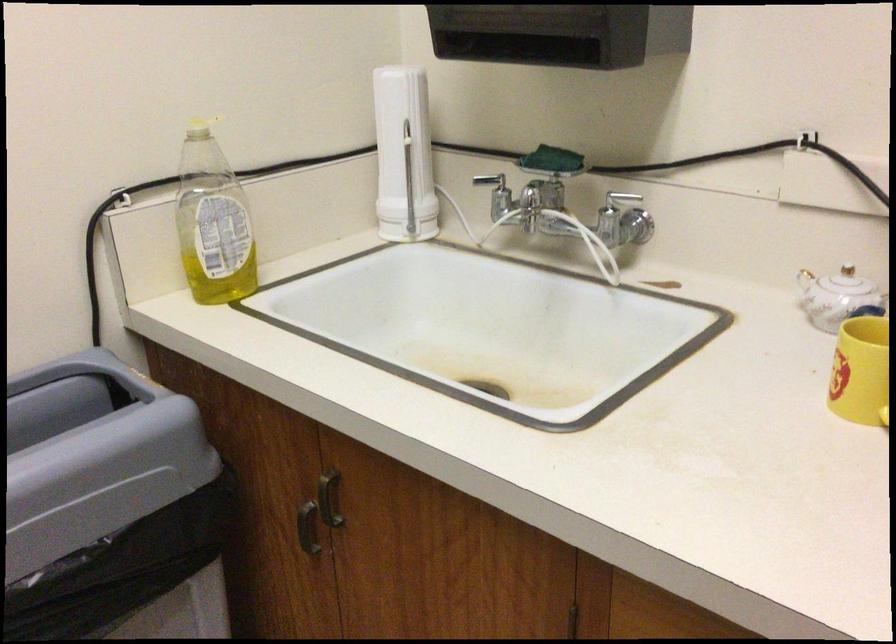
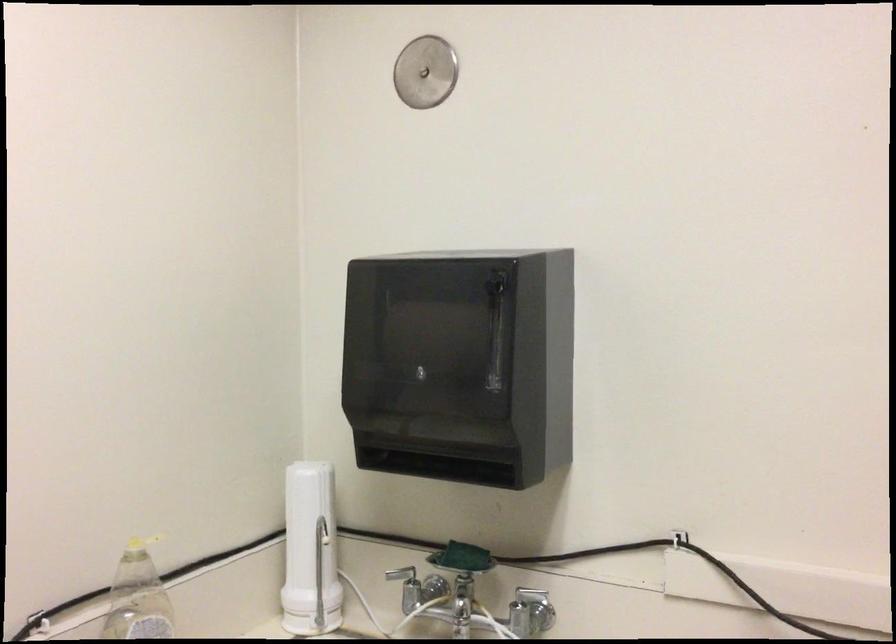
Find the pixel in the second image that matches [549,162] in the first image.

(462, 558)